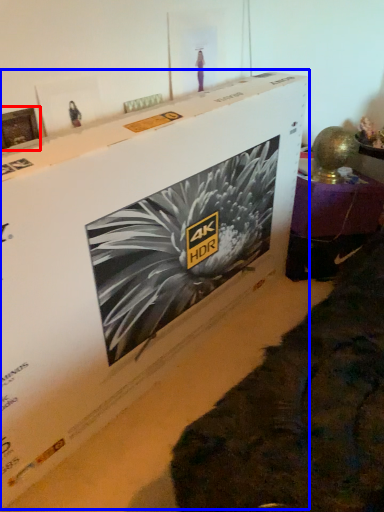
Question: Which point is further to the camera, picture frame (highlighted by a red box) or cardboard box (highlighted by a blue box)?

Choices:
 (A) picture frame
 (B) cardboard box

Answer: (A)